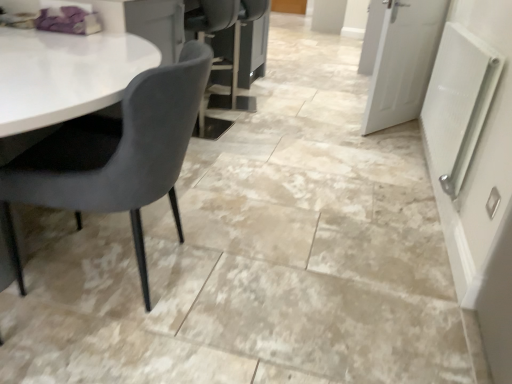
Find the location of `vacant area to the right of velvet grey chair at left`. vacant area to the right of velvet grey chair at left is located at coordinates (270, 281).